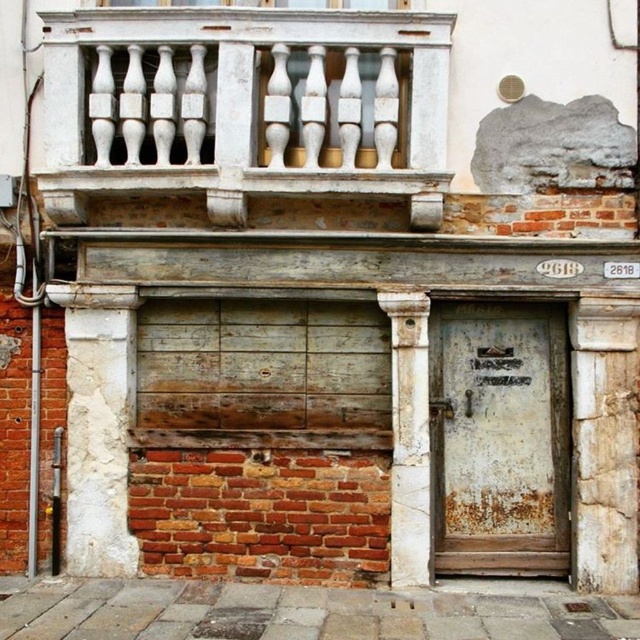
You are an architect examining the old building. You need to determine the spatial relationship between the white marble column at center and the rusty metal door at lower right. Which object is located to the left of the other?

The white marble column at center is positioned on the left side of rusty metal door at lower right.

You are standing in front of the old building and want to know if the point at coordinates point (x=83, y=387) is closer to you than the point at coordinates point (x=422, y=404). Can you determine this?

Point (x=83, y=387) is behind point (x=422, y=404), so it is farther away from you.

You are standing in front of an old building and see a rusty wood door at center and a white rough stone pillar at left. Which object is positioned to the right of the other?

The rusty wood door at center is to the right of the white rough stone pillar at left.